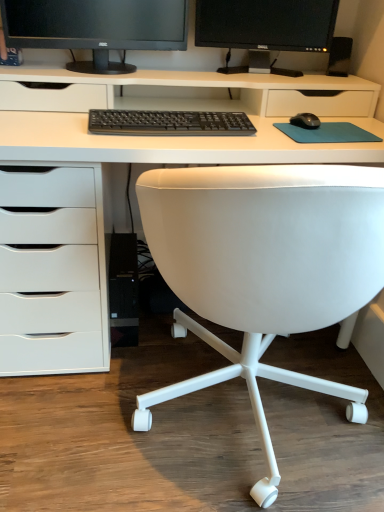
You are a GUI agent. You are given a task and a screenshot of the screen. Output one action in this format:
    pyautogui.click(x=<x>, y=<y>)
    Task: Click on the free area below black matte monitor at upper center, the 1th computer monitor when ordered from left to right (from a real-world perspective)
    This screenshot has height=512, width=384.
    Given the screenshot: What is the action you would take?
    pyautogui.click(x=109, y=67)